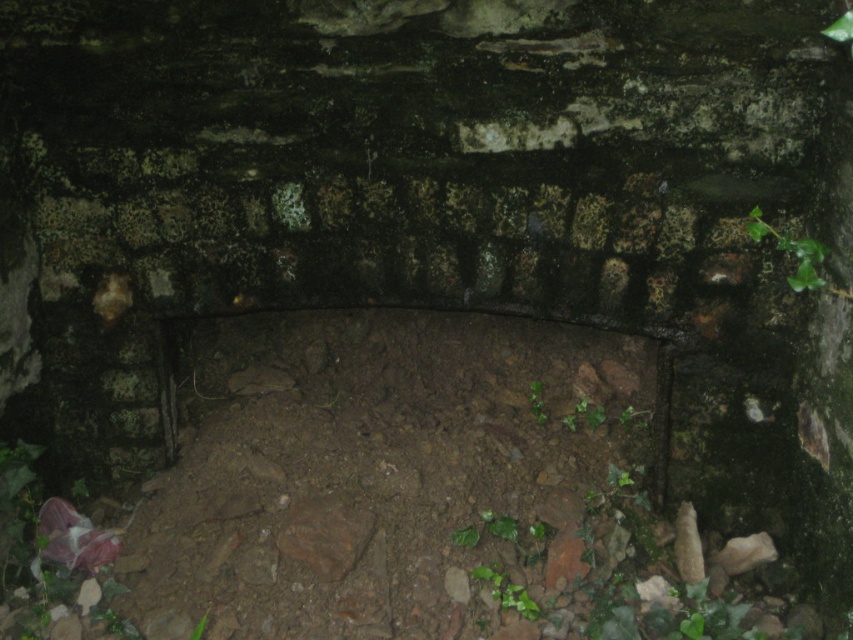
Describe the element at coordinates (791, 252) in the screenshot. I see `green leafy plant at upper right` at that location.

You are a GUI agent. You are given a task and a screenshot of the screen. Output one action in this format:
    pyautogui.click(x=<x>, y=<y>)
    Task: Click on the green leafy plant at upper right
    This screenshot has height=640, width=853.
    Given the screenshot: What is the action you would take?
    pyautogui.click(x=791, y=252)